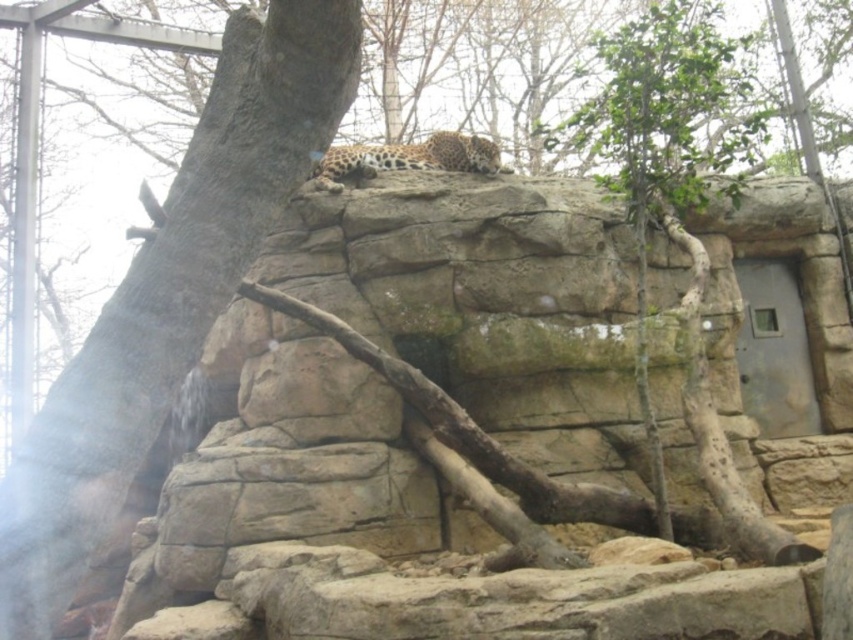
Which of these two, smooth gray tree trunk at upper left or spotted fur leopard at upper center, stands taller?

With more height is smooth gray tree trunk at upper left.

Who is lower down, smooth gray tree trunk at upper left or spotted fur leopard at upper center?

smooth gray tree trunk at upper left is lower down.

The image size is (853, 640). Describe the element at coordinates (170, 296) in the screenshot. I see `smooth gray tree trunk at upper left` at that location.

This screenshot has width=853, height=640. I want to click on smooth gray tree trunk at upper left, so click(170, 296).

Is green leafy tree at upper right taller than spotted fur leopard at upper center?

Indeed, green leafy tree at upper right has a greater height compared to spotted fur leopard at upper center.

Measure the distance from green leafy tree at upper right to spotted fur leopard at upper center.

green leafy tree at upper right is 20.20 meters away from spotted fur leopard at upper center.

What do you see at coordinates (676, 200) in the screenshot? The image size is (853, 640). I see `green leafy tree at upper right` at bounding box center [676, 200].

I want to click on green leafy tree at upper right, so click(x=676, y=200).

Is smooth gray tree trunk at upper left below green leafy tree at upper right?

Yes.

Which of these two, smooth gray tree trunk at upper left or green leafy tree at upper right, stands shorter?

smooth gray tree trunk at upper left is shorter.

Where is `smooth gray tree trunk at upper left`? The width and height of the screenshot is (853, 640). smooth gray tree trunk at upper left is located at coordinates (170, 296).